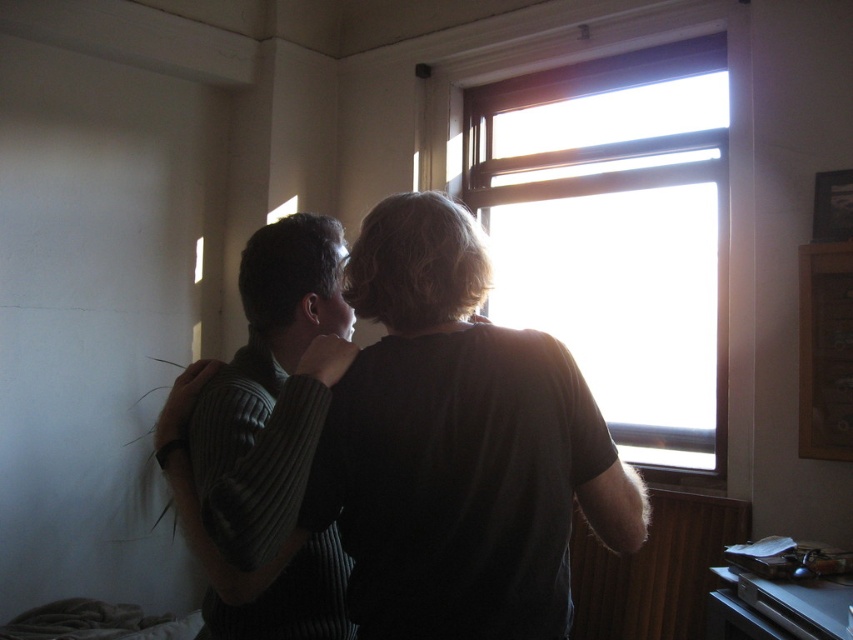
Which is behind, point (525, 573) or point (281, 611)?

The point (281, 611) is behind.

Can you confirm if dark gray sweater at center is shorter than ribbed sweater at center?

Yes.

In order to click on dark gray sweater at center in this screenshot , I will do `click(440, 451)`.

Where is `dark gray sweater at center`? dark gray sweater at center is located at coordinates (440, 451).

Can you confirm if dark gray sweater at center is smaller than transparent glass window at upper center?

Indeed, dark gray sweater at center has a smaller size compared to transparent glass window at upper center.

Does point (422, 387) lie in front of point (512, 243)?

Yes, it is in front of point (512, 243).

Where is `dark gray sweater at center`? Image resolution: width=853 pixels, height=640 pixels. dark gray sweater at center is located at coordinates (440, 451).

Looking at this image, can you confirm if transparent glass window at upper center is shorter than ribbed sweater at center?

No.

Is point (598, 292) farther from camera compared to point (270, 632)?

That is True.

Where is `transparent glass window at upper center`? Image resolution: width=853 pixels, height=640 pixels. transparent glass window at upper center is located at coordinates (611, 228).

Locate an element on the screen. transparent glass window at upper center is located at coordinates (611, 228).